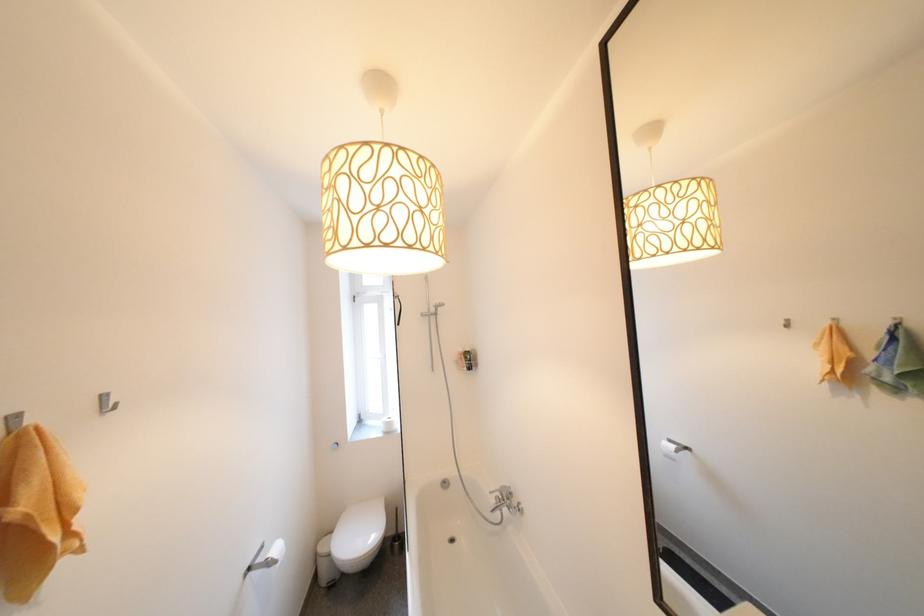
The location [673,448] corresponds to which object?

This point indicates the roll of toilet paper.